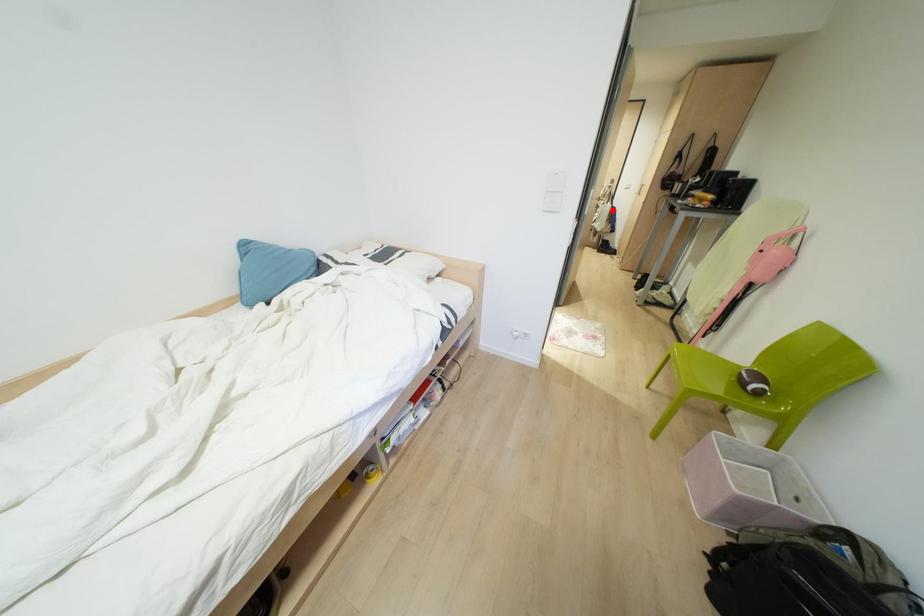
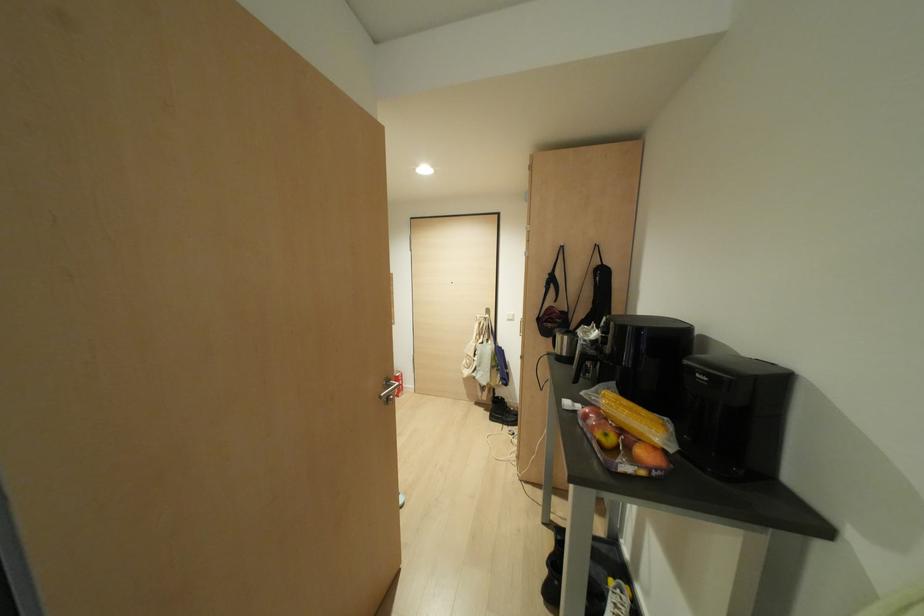
Question: I am providing you with two images of the same scene from different viewpoints. Given a red point in image1, look at the same physical point in image2. Is it:

Choices:
 (A) Closer to the viewpoint
 (B) Farther from the viewpoint

Answer: (A)